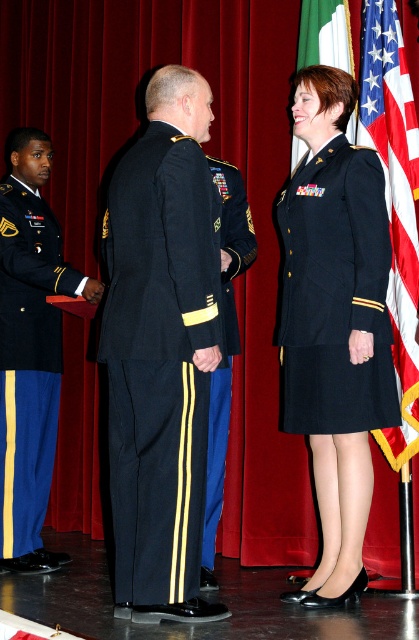
You are attending a military ceremony and notice two points marked on the floor. The first point is at coordinate point(206, 436) and the second is at point(33, 236). If you are standing at the first point, which direction should you face to see the second point?

Since point(206, 436) is in front of point(33, 236), you should face backwards to see the second point.

You are attending a military ceremony and notice two individuals in uniforms. The navy blue fabric uniform at center and the blue wool uniform at left. Based on their positions, which one is higher in rank?

The navy blue fabric uniform at center is higher in rank because it is positioned above the blue wool uniform at left, indicating a superior rank in the ceremony setup.

Based on the scene description, which uniform is positioned lower between the navy blue fabric uniform at center and the navy blue wool dress uniform at center?

The navy blue fabric uniform at center is positioned lower than the navy blue wool dress uniform at center.